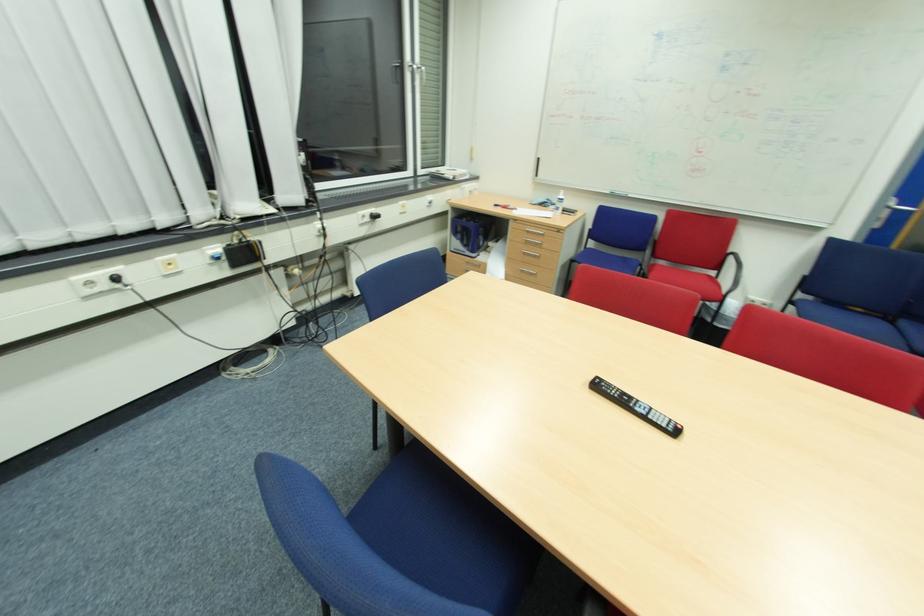
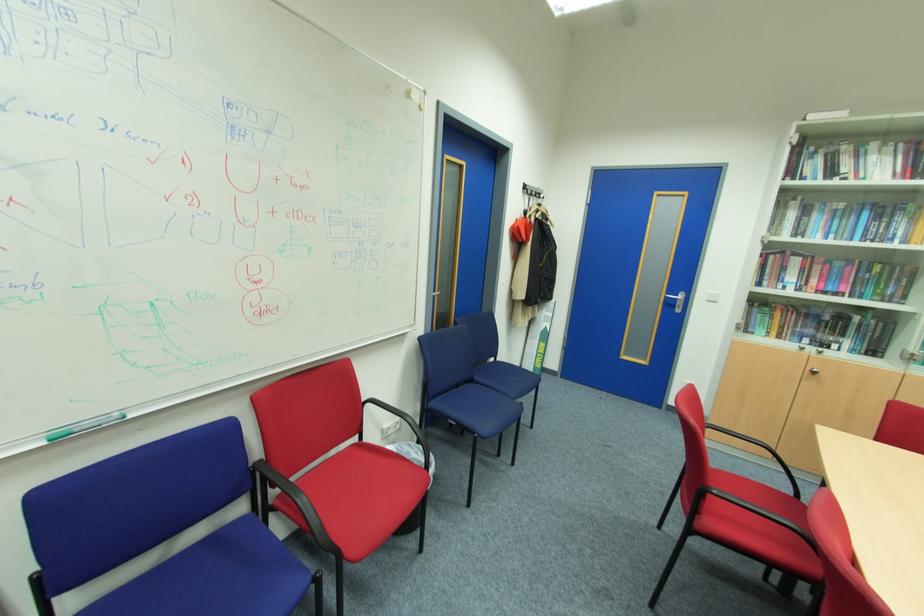
The point at (733, 251) is marked in the first image. Where is the corresponding point in the second image?

(367, 400)